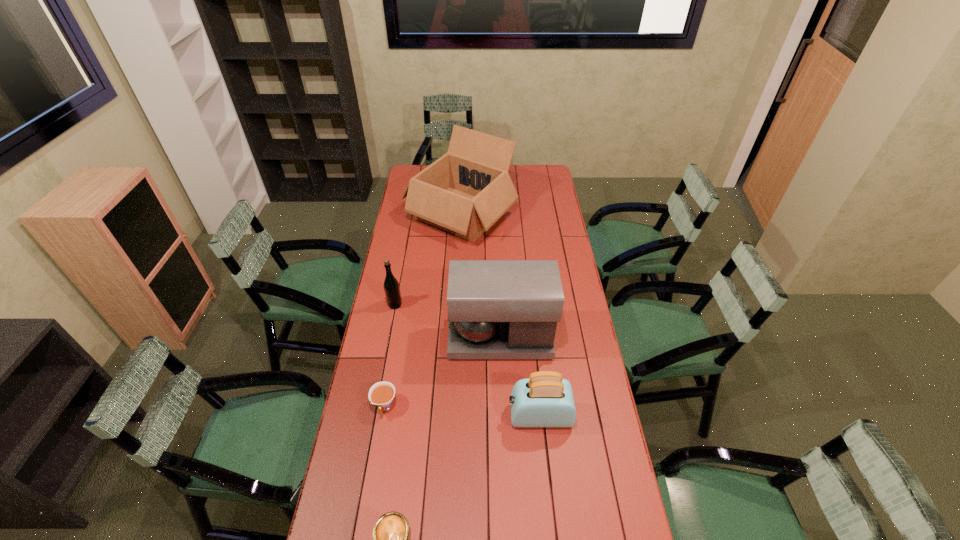
Locate an element on the screen. The image size is (960, 540). free space between the teacup and the fourth nearest object is located at coordinates (443, 373).

Locate an element on the screen. The height and width of the screenshot is (540, 960). vacant area that lies between the beer bottle and the shortest object is located at coordinates coord(390,355).

The width and height of the screenshot is (960, 540). I want to click on free point between the teacup and the box, so click(422, 310).

Image resolution: width=960 pixels, height=540 pixels. I want to click on free point between the fourth nearest object and the shortest object, so click(x=443, y=373).

Identify which object is located as the fourth nearest to the toaster. Please provide its 2D coordinates. Your answer should be formatted as a tuple, i.e. [(x, y)], where the tuple contains the x and y coordinates of a point satisfying the conditions above.

[(391, 286)]

This screenshot has width=960, height=540. In order to click on object that stands as the second closest to the farthest object in this screenshot , I will do `click(497, 309)`.

Where is `vacant point that satisfies the following two spatial constraints: 1. on the carafe side of the third farthest object; 2. on the side of the shortest object with the handle`? vacant point that satisfies the following two spatial constraints: 1. on the carafe side of the third farthest object; 2. on the side of the shortest object with the handle is located at coordinates (503, 407).